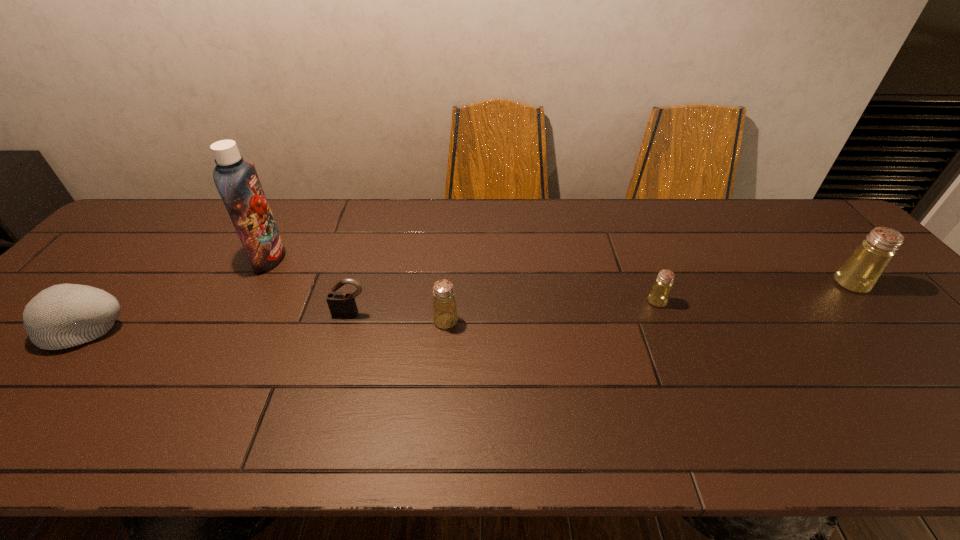
I want to click on vacant area in the image that satisfies the following two spatial constraints: 1. on the front label of the tallest object; 2. on the back side of the shortest object, so click(x=246, y=301).

What are the coordinates of `free space that satisfies the following two spatial constraints: 1. with the keyhole on the front of the second tallest saltshaker; 2. on the right side of the third object from left to right` in the screenshot? It's located at tap(348, 321).

The width and height of the screenshot is (960, 540). In order to click on free space that satisfies the following two spatial constraints: 1. on the front label of the tallest object; 2. on the left side of the shortest saltshaker in this screenshot , I will do `click(246, 301)`.

Locate an element on the screen. vacant space that satisfies the following two spatial constraints: 1. on the front label of the second object from left to right; 2. on the back side of the shortest saltshaker is located at coordinates (246, 301).

At what (x,y) coordinates should I click in order to perform the action: click on free spot that satisfies the following two spatial constraints: 1. on the front label of the shortest saltshaker; 2. on the right side of the fifth object from right to left. Please return your answer as a coordinate pair (x, y). The height and width of the screenshot is (540, 960). Looking at the image, I should click on (246, 301).